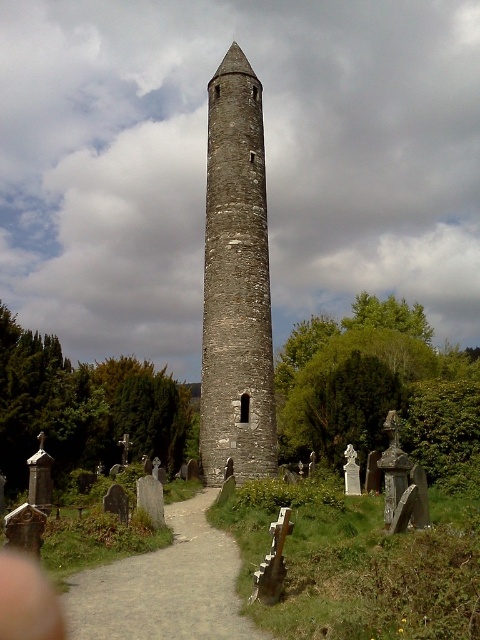
Who is positioned more to the right, gray stone tower at center or dirt/gravel path at center?

gray stone tower at center is more to the right.

Does point (237, 381) come behind point (228, 598)?

That is True.

Find the location of a particular element. This screenshot has width=480, height=640. gray stone tower at center is located at coordinates (236, 282).